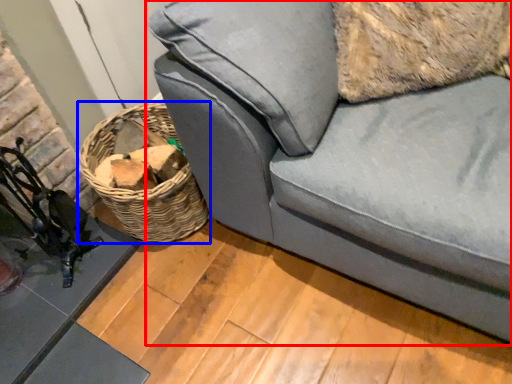
Question: Which of the following is the farthest to the observer, studio couch (highlighted by a red box) or basket (highlighted by a blue box)?

Choices:
 (A) studio couch
 (B) basket

Answer: (B)